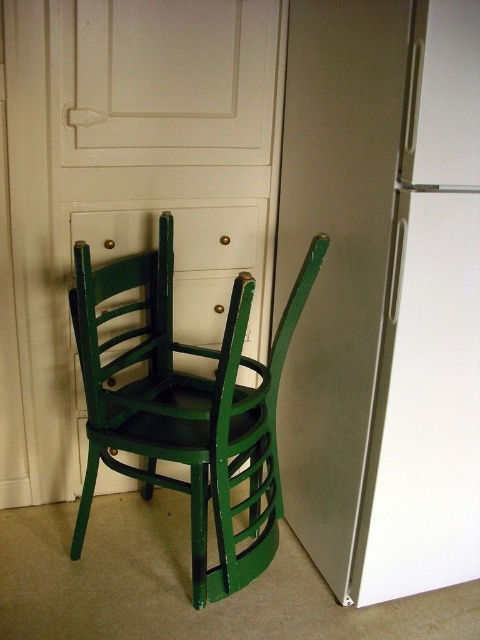
Between satin white refrigerator at center right and green matte wood chair at center, which one is positioned lower?

green matte wood chair at center is lower down.

Is point (292, 61) positioned behind point (163, 308)?

That is False.

Identify the location of satin white refrigerator at center right. The height and width of the screenshot is (640, 480). (383, 292).